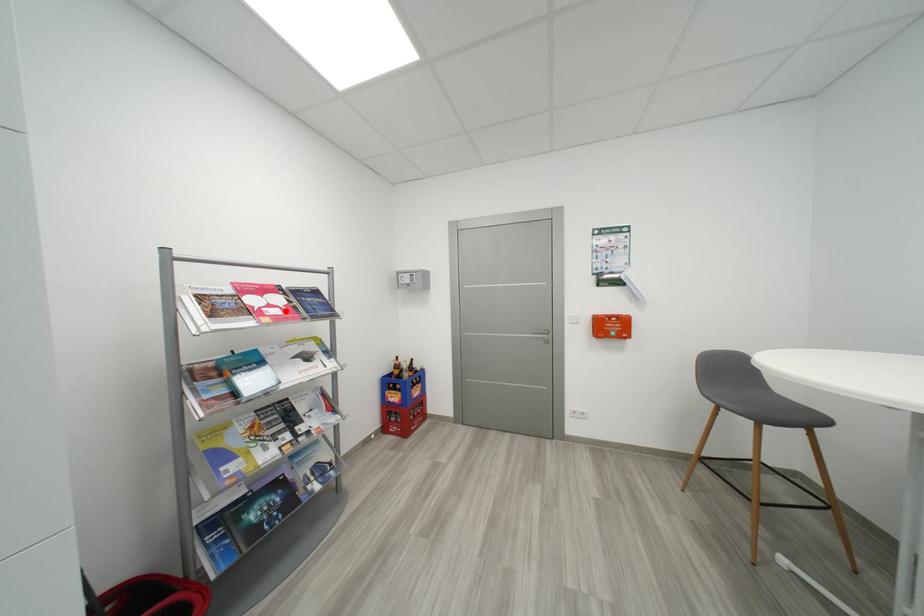
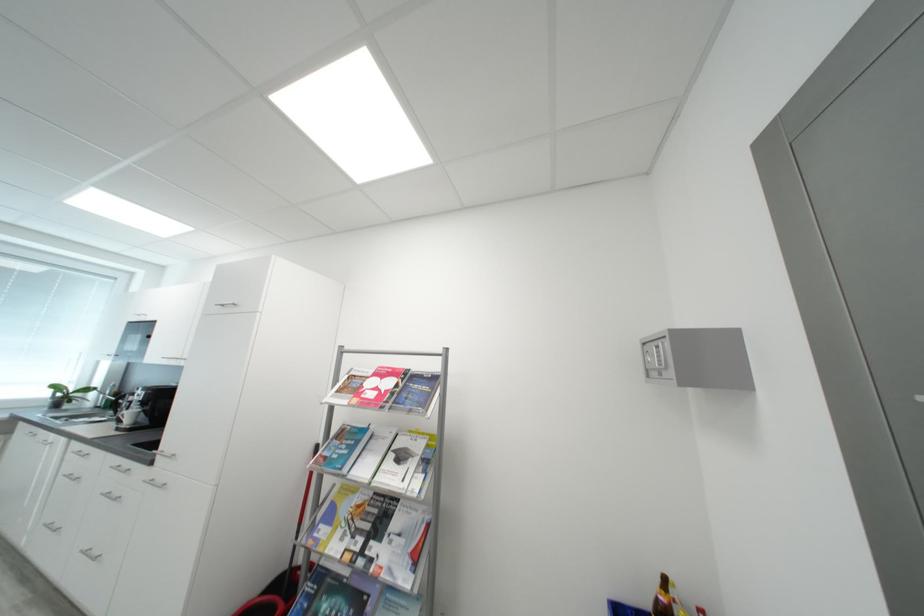
Find the pixel in the second image that matches the highlighted location in the first image.

(383, 395)